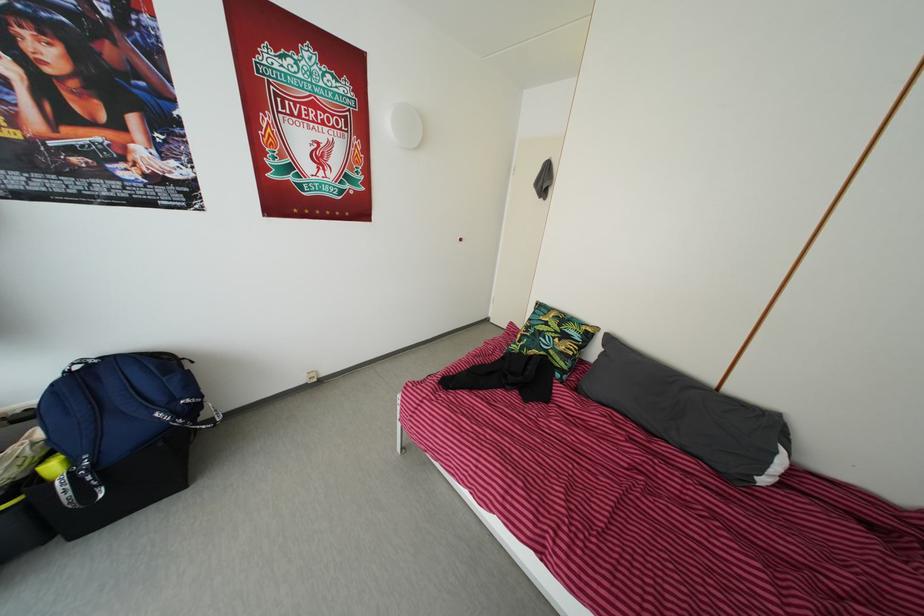
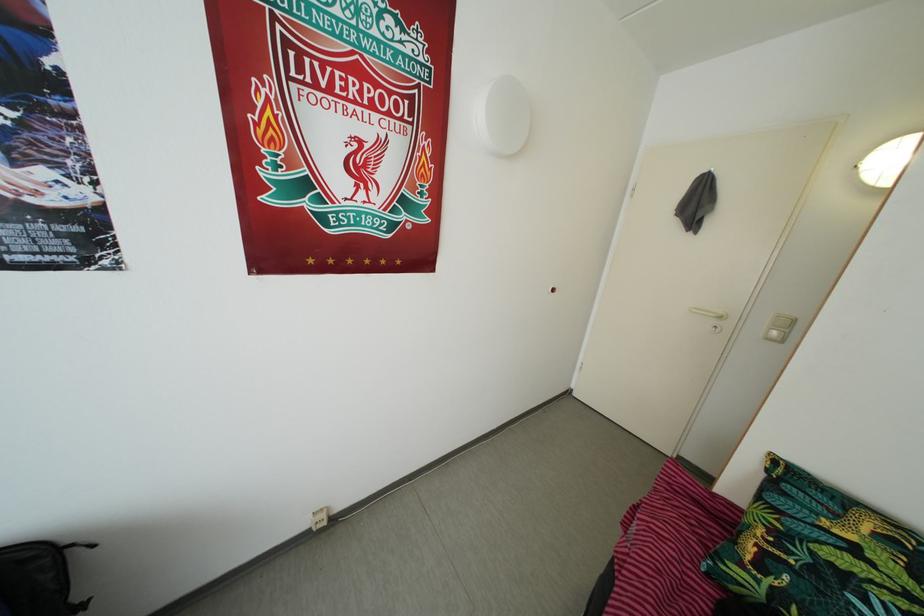
Locate, in the second image, the point that corresponds to point 551,188 in the first image.

(703, 213)